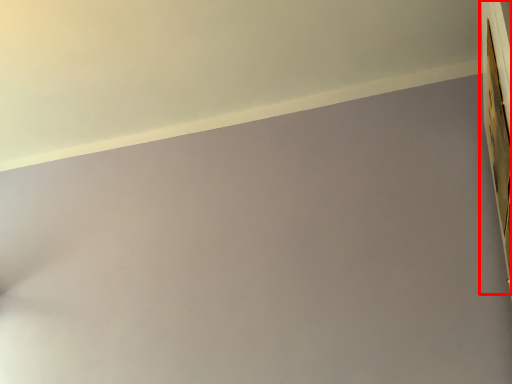
Question: From the image, what is the correct spatial relationship of window frame (annotated by the red box) in relation to window sill?

Choices:
 (A) left
 (B) right

Answer: (B)